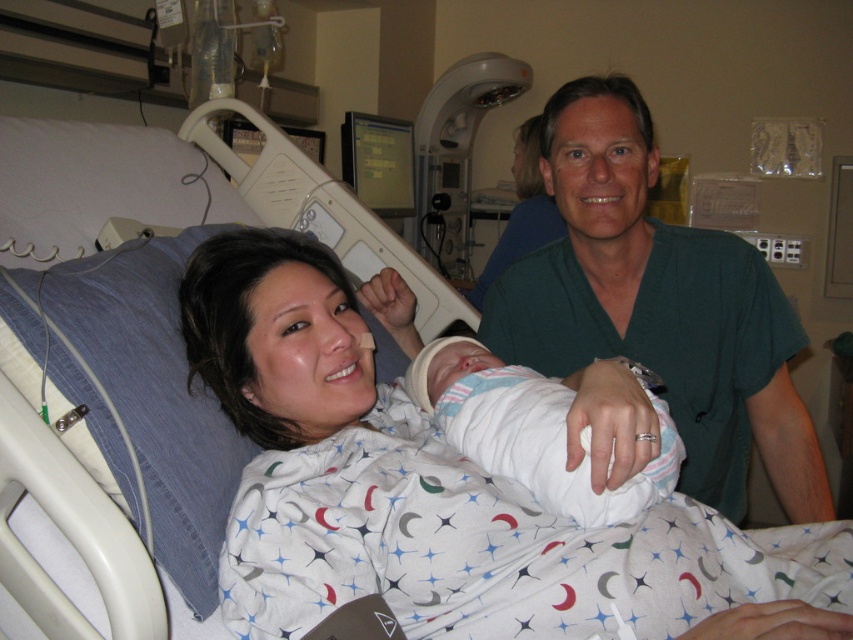
Based on the photo, you are a nurse in the hospital room and need to check the newborn baby in the white swaddled newborn at center. The green scrubs at center is a doctor who is blocking your path. Can you move around the newborn to reach the baby?

The green scrubs at center is to the right of the white swaddled newborn at center, so you can move around the newborn to the left side to reach the baby.

You are a nurse in the hospital and need to determine if the green scrubs at center can be used to cover the white swaddled newborn at center. Based on their sizes, is this possible?

The green scrubs at center is larger in size than the white swaddled newborn at center, so yes, the scrubs can be used to cover the newborn.

You are a nurse in the hospital and need to check the vital signs of the white swaddled newborn at center. However, the green scrubs at center is blocking your path. Can you easily access the newborn?

The green scrubs at center is positioned over the white swaddled newborn at center, so you cannot easily access the newborn without moving the healthcare provider in green scrubs at center.